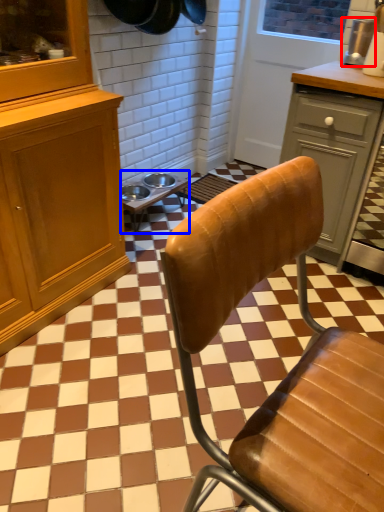
Question: Among these objects, which one is nearest to the camera, appliance (highlighted by a red box) or table (highlighted by a blue box)?

Choices:
 (A) appliance
 (B) table

Answer: (A)